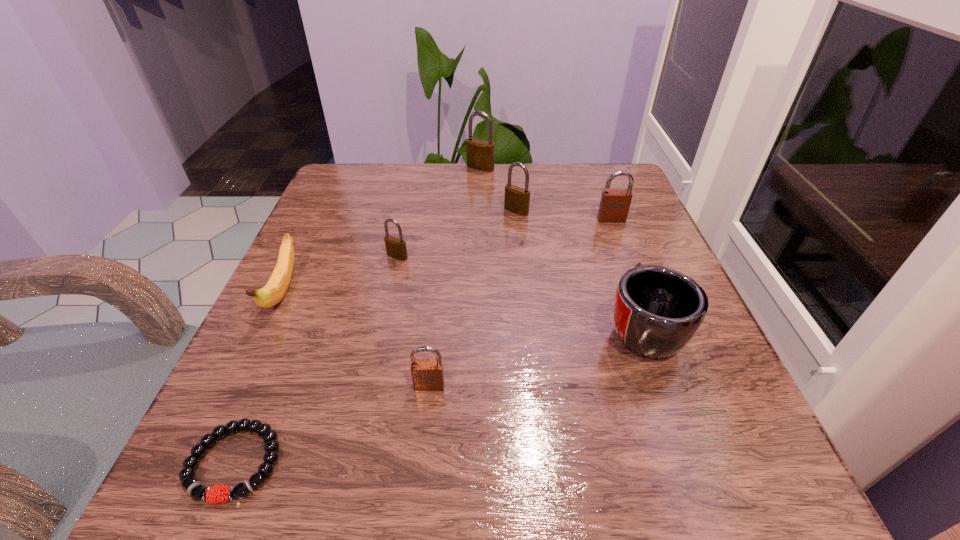
Where is `vacant space at the far edge of the desktop`? This screenshot has height=540, width=960. vacant space at the far edge of the desktop is located at coordinates (448, 178).

The width and height of the screenshot is (960, 540). I want to click on free space at the near edge, so click(485, 445).

In the image, there is a desktop. In order to click on vacant space at the left edge in this screenshot , I will do `click(332, 300)`.

Image resolution: width=960 pixels, height=540 pixels. In the image, there is a desktop. In order to click on vacant region at the far left corner in this screenshot , I will do `click(352, 166)`.

Locate an element on the screen. The height and width of the screenshot is (540, 960). free location at the near left corner of the desktop is located at coordinates (204, 484).

The height and width of the screenshot is (540, 960). In the image, there is a desktop. What are the coordinates of `vacant area at the far right corner` in the screenshot? It's located at (620, 168).

This screenshot has height=540, width=960. Find the location of `vacant space in between the farther brown padlock and the nearer brown padlock`. vacant space in between the farther brown padlock and the nearer brown padlock is located at coordinates (520, 302).

I want to click on vacant region between the yellow banana and the red mug, so click(463, 310).

The width and height of the screenshot is (960, 540). I want to click on free space between the fourth object from right to left and the second nearest padlock, so click(x=439, y=212).

Find the location of a particular element. vacant space that's between the nearest padlock and the banana is located at coordinates (356, 339).